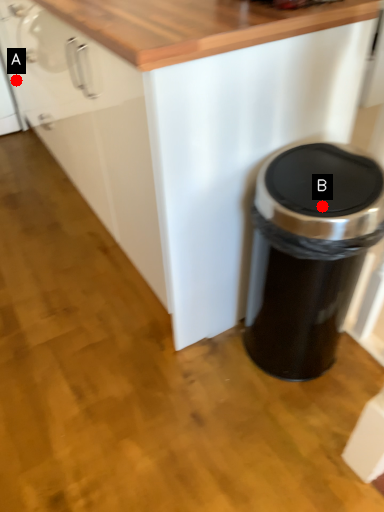
Question: Two points are circled on the image, labeled by A and B beside each circle. Which point appears closest to the camera in this image?

Choices:
 (A) A is closer
 (B) B is closer

Answer: (B)